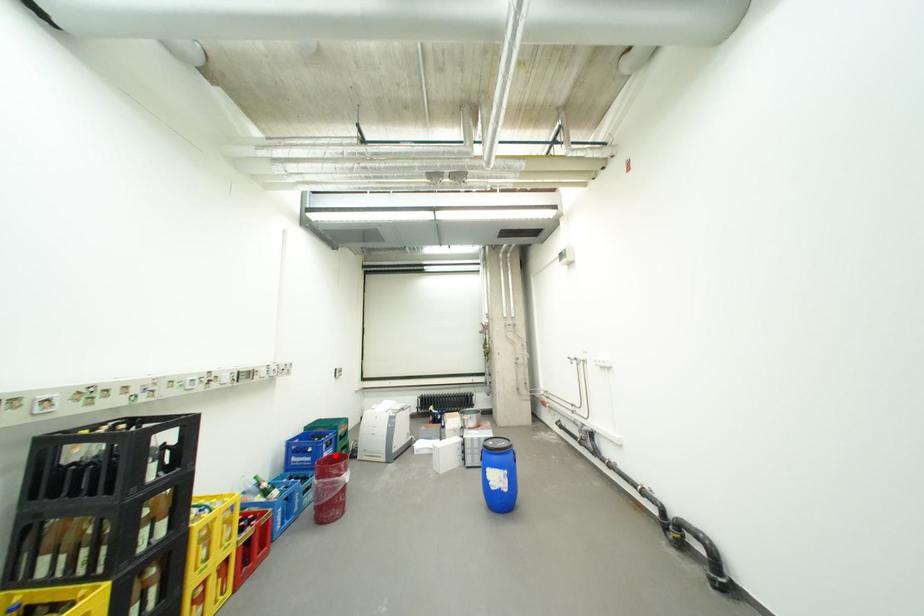
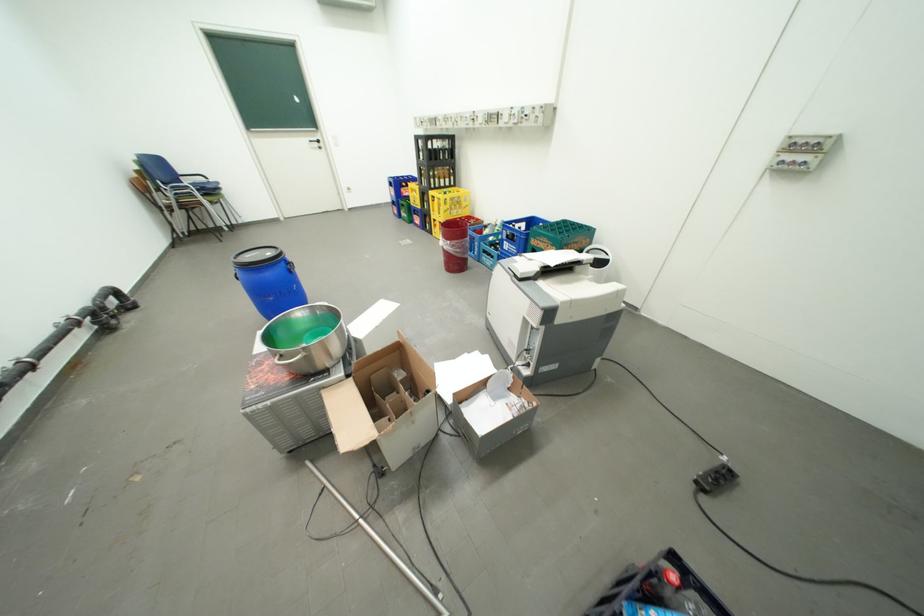
Find the pixel in the second image that matches the highlighted location in the first image.

(516, 244)